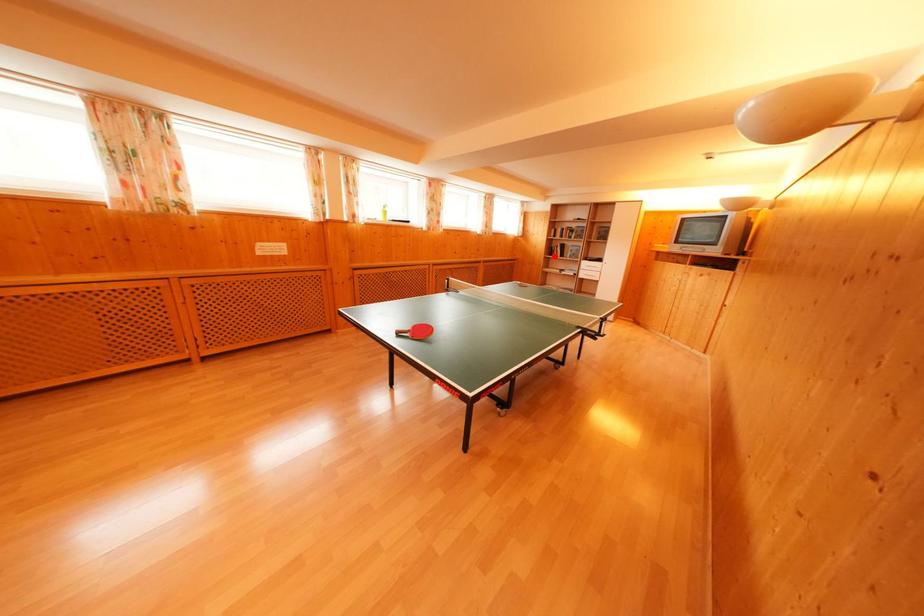
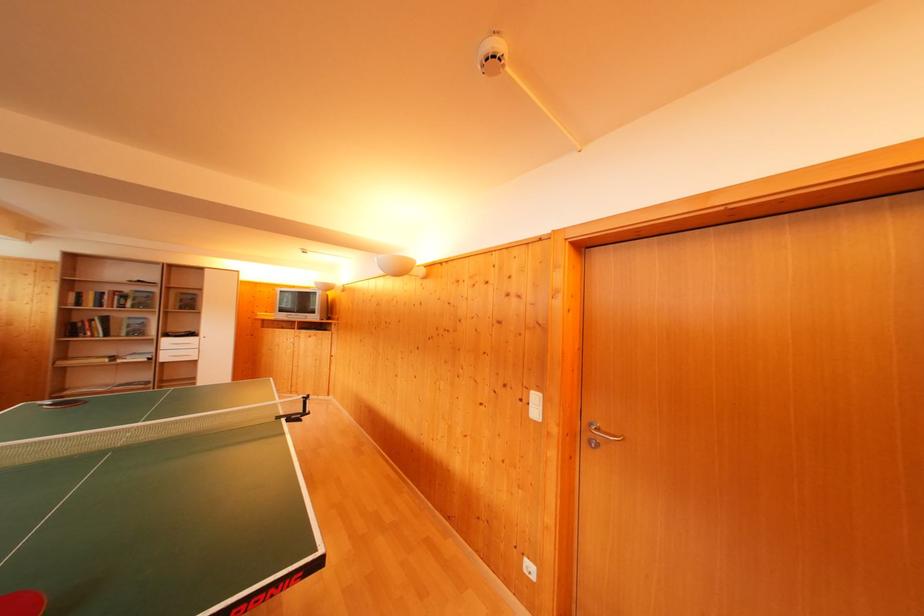
Question: I am providing you with two images of the same scene from different viewpoints. Image1 has a red point marked. In image2, the corresponding 3D location appears at what relative position? Reply with the corresponding letter.

Choices:
 (A) Closer
 (B) Farther

Answer: (B)